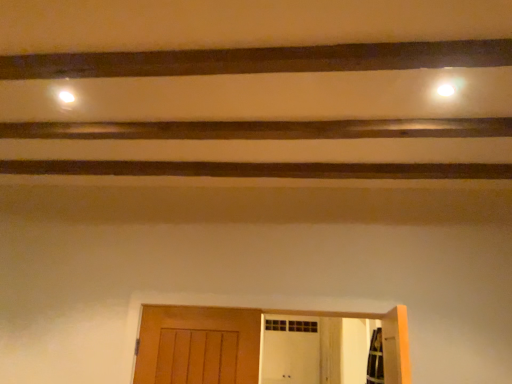
The image size is (512, 384). What do you see at coordinates (244, 341) in the screenshot?
I see `wooden door at lower center` at bounding box center [244, 341].

Where is `wooden door at lower center`? wooden door at lower center is located at coordinates (244, 341).

What do you see at coordinates (260, 60) in the screenshot?
I see `brown wooden plank at upper center` at bounding box center [260, 60].

Image resolution: width=512 pixels, height=384 pixels. Find the location of `brown wooden plank at upper center`. brown wooden plank at upper center is located at coordinates (260, 60).

What is the approximate width of brown wooden plank at upper center?

brown wooden plank at upper center is 11.51 centimeters wide.

Identify the location of wooden door at lower center. The width and height of the screenshot is (512, 384). (x=244, y=341).

Does wooden door at lower center appear on the left side of brown wooden plank at upper center?

Incorrect, wooden door at lower center is not on the left side of brown wooden plank at upper center.

Is wooden door at lower center positioned behind brown wooden plank at upper center?

Yes, it is behind brown wooden plank at upper center.

Is point (396, 316) closer or farther from the camera than point (381, 68)?

Point (396, 316).

From the image's perspective, is wooden door at lower center above or below brown wooden plank at upper center?

From the image's perspective, wooden door at lower center appears below brown wooden plank at upper center.

From a real-world perspective, is wooden door at lower center physically located above or below brown wooden plank at upper center?

wooden door at lower center is situated lower than brown wooden plank at upper center in the real world.

Which object is wider, wooden door at lower center or brown wooden plank at upper center?

With larger width is brown wooden plank at upper center.

Consider the image. Between wooden door at lower center and brown wooden plank at upper center, which one has less height?

brown wooden plank at upper center.

Considering the relative sizes of wooden door at lower center and brown wooden plank at upper center in the image provided, is wooden door at lower center smaller than brown wooden plank at upper center?

Actually, wooden door at lower center might be larger than brown wooden plank at upper center.

Can brown wooden plank at upper center be found inside wooden door at lower center?

That's incorrect, brown wooden plank at upper center is not inside wooden door at lower center.

Are wooden door at lower center and brown wooden plank at upper center far apart?

Indeed, wooden door at lower center is not near brown wooden plank at upper center.

Is wooden door at lower center oriented towards brown wooden plank at upper center?

No, wooden door at lower center is not facing towards brown wooden plank at upper center.

How different are the orientations of wooden door at lower center and brown wooden plank at upper center in degrees?

There is a 180-degree angle between the facing directions of wooden door at lower center and brown wooden plank at upper center.

I want to click on plank above the wooden door at lower center (from the image's perspective), so click(260, 60).

Between brown wooden plank at upper center and wooden door at lower center, which one appears on the right side from the viewer's perspective?

Positioned to the right is wooden door at lower center.

Which object is more forward, brown wooden plank at upper center or wooden door at lower center?

brown wooden plank at upper center.

Which is behind, point (189, 59) or point (157, 344)?

The point (157, 344) is farther from the camera.

From the image's perspective, between brown wooden plank at upper center and wooden door at lower center, which one is located above?

From the image's view, brown wooden plank at upper center is above.

From a real-world perspective, is brown wooden plank at upper center positioned above or below wooden door at lower center?

brown wooden plank at upper center is situated higher than wooden door at lower center in the real world.

Does brown wooden plank at upper center have a greater width compared to wooden door at lower center?

Yes.

Considering the relative sizes of brown wooden plank at upper center and wooden door at lower center in the image provided, is brown wooden plank at upper center taller than wooden door at lower center?

No.

Who is bigger, brown wooden plank at upper center or wooden door at lower center?

wooden door at lower center is bigger.

In the scene shown: Is brown wooden plank at upper center outside of wooden door at lower center?

Yes, brown wooden plank at upper center is outside of wooden door at lower center.

Is brown wooden plank at upper center far from wooden door at lower center?

Yes, brown wooden plank at upper center is far from wooden door at lower center.

Is brown wooden plank at upper center oriented towards wooden door at lower center?

No, brown wooden plank at upper center is not turned towards wooden door at lower center.

Measure the distance between brown wooden plank at upper center and wooden door at lower center.

The distance of brown wooden plank at upper center from wooden door at lower center is 4.47 feet.

I want to click on door below the brown wooden plank at upper center (from the image's perspective), so click(244, 341).

At what (x,y) coordinates should I click in order to perform the action: click on plank on the left side of wooden door at lower center. Please return your answer as a coordinate pair (x, y). Looking at the image, I should click on (260, 60).

Where is `door located behind the brown wooden plank at upper center`? This screenshot has width=512, height=384. door located behind the brown wooden plank at upper center is located at coordinates (244, 341).